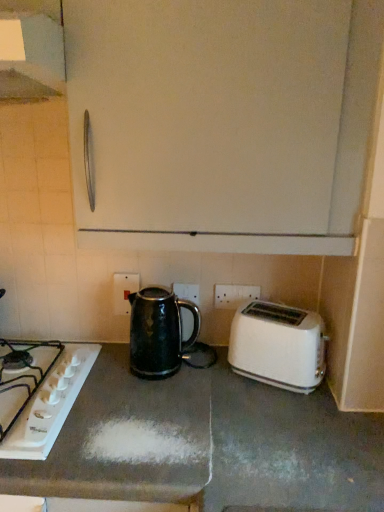
The image size is (384, 512). Identify the location of free point to the left of white plastic toaster at lower right. (216, 379).